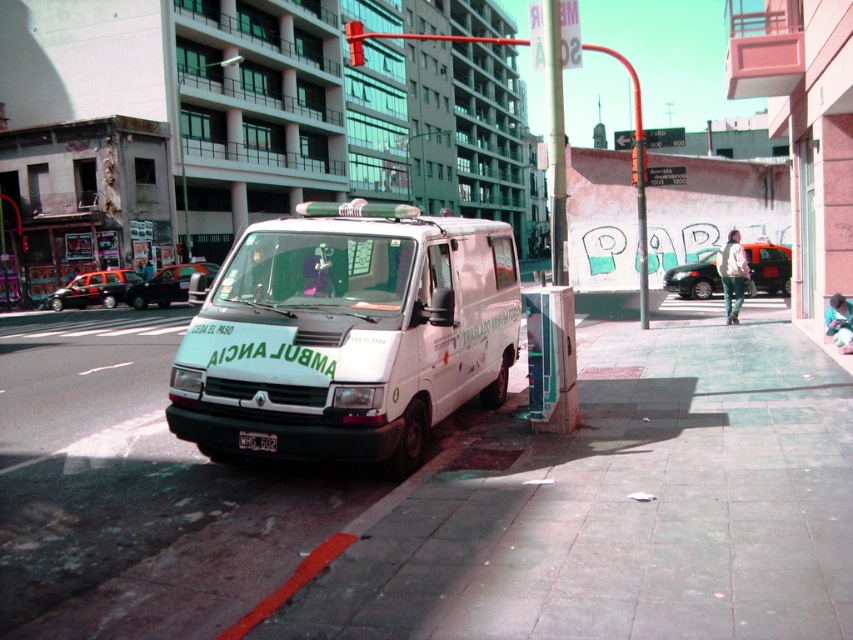
You are a delivery person with a 1.8 meter wide cart. You need to move from the white concrete sidewalk at lower center to the white matte van at center. Is there enough space for your cart to pass between them?

The white concrete sidewalk at lower center is 2.82 meters from the white matte van at center. Since your cart is 1.8 meters wide, there is sufficient space to pass between them as 2.82 meters is wider than 1.8 meters.

You are a delivery person needing to park your 3m long vehicle. The white matte van at center is parked on the white concrete sidewalk at lower center. Can you park your vehicle there without overlapping the sidewalk?

The white concrete sidewalk at lower center is smaller than the white matte van at center, which is already parked there. Since the sidewalk is smaller than the van, it likely cannot accommodate your 3m long vehicle without overlapping.

You are a delivery person standing on the white concrete sidewalk at lower center. You need to place a package on top of the white matte van at center. Can you reach the top of the van without any additional tools?

The white concrete sidewalk at lower center has a lesser height compared to white matte van at center, so you cannot reach the top of the van without a ladder or step stool.